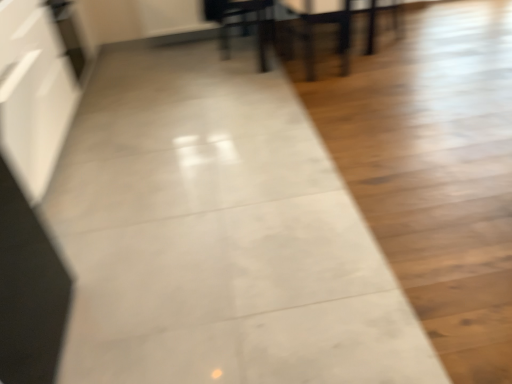
Question: Is matte black dining chair at upper center oriented towards wooden table at center?

Choices:
 (A) no
 (B) yes

Answer: (B)

Question: Is wooden table at center at the back of matte black dining chair at upper center?

Choices:
 (A) yes
 (B) no

Answer: (A)

Question: From the image's perspective, is matte black dining chair at upper center under wooden table at center?

Choices:
 (A) no
 (B) yes

Answer: (B)

Question: Is matte black dining chair at upper center not within wooden table at center?

Choices:
 (A) no
 (B) yes

Answer: (A)

Question: Does matte black dining chair at upper center come behind wooden table at center?

Choices:
 (A) no
 (B) yes

Answer: (B)

Question: Is the depth of matte black dining chair at upper center less than that of wooden table at center?

Choices:
 (A) no
 (B) yes

Answer: (A)

Question: Can you confirm if matte black armchair at upper center is taller than wooden table at center?

Choices:
 (A) yes
 (B) no

Answer: (A)

Question: Is matte black armchair at upper center bigger than wooden table at center?

Choices:
 (A) no
 (B) yes

Answer: (A)

Question: Are matte black armchair at upper center and wooden table at center making contact?

Choices:
 (A) yes
 (B) no

Answer: (B)

Question: From a real-world perspective, is matte black armchair at upper center on top of wooden table at center?

Choices:
 (A) no
 (B) yes

Answer: (B)

Question: Is matte black armchair at upper center aimed at wooden table at center?

Choices:
 (A) yes
 (B) no

Answer: (A)

Question: Considering the relative positions of matte black armchair at upper center and wooden table at center in the image provided, is matte black armchair at upper center behind wooden table at center?

Choices:
 (A) no
 (B) yes

Answer: (A)

Question: Would you consider matte black chair at upper right to be distant from matte black dining chair at upper center?

Choices:
 (A) no
 (B) yes

Answer: (B)